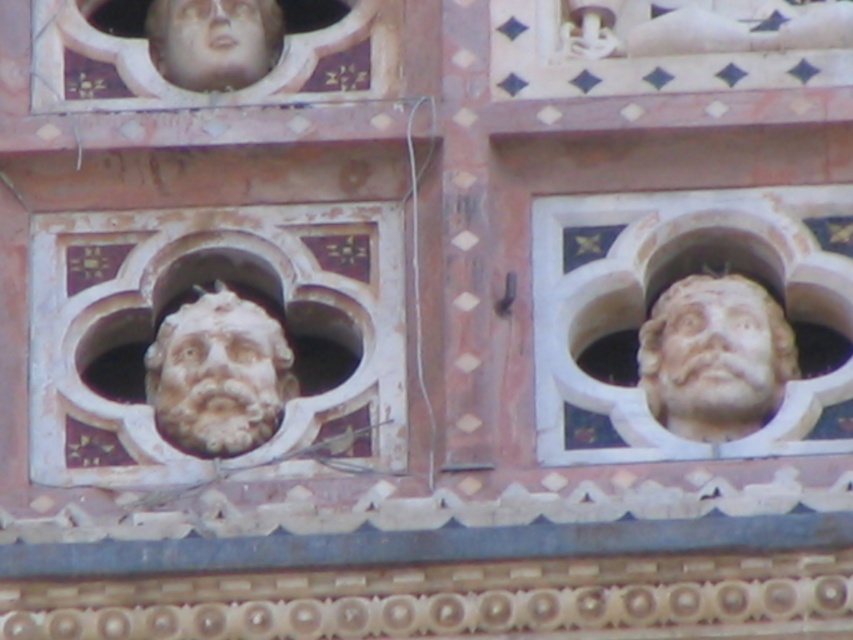
Who is more distant from viewer, (67, 337) or (723, 404)?

Point (67, 337)

Does white stone face at center-left appear over white marble head at right?

Actually, white stone face at center-left is below white marble head at right.

Does point (299, 241) lie in front of point (724, 300)?

No, it is behind (724, 300).

You are a GUI agent. You are given a task and a screenshot of the screen. Output one action in this format:
    pyautogui.click(x=<x>, y=<y>)
    Task: Click on the white stone face at center-left
    
    Given the screenshot: What is the action you would take?
    pyautogui.click(x=189, y=292)

Is matte stone face at upper left to the right of smooth stone face at upper center from the viewer's perspective?

In fact, matte stone face at upper left is to the left of smooth stone face at upper center.

Is matte stone face at upper left behind smooth stone face at upper center?

Yes.

At what (x,y) coordinates should I click in order to perform the action: click on matte stone face at upper left. Please return your answer as a coordinate pair (x, y). Looking at the image, I should click on (206, 52).

Is point (277, 58) farther from camera compared to point (265, 422)?

Yes.

Which of these two, matte stone face at upper left or white stone face at center, stands taller?

white stone face at center is taller.

At what (x,y) coordinates should I click in order to perform the action: click on matte stone face at upper left. Please return your answer as a coordinate pair (x, y). The width and height of the screenshot is (853, 640). Looking at the image, I should click on (206, 52).